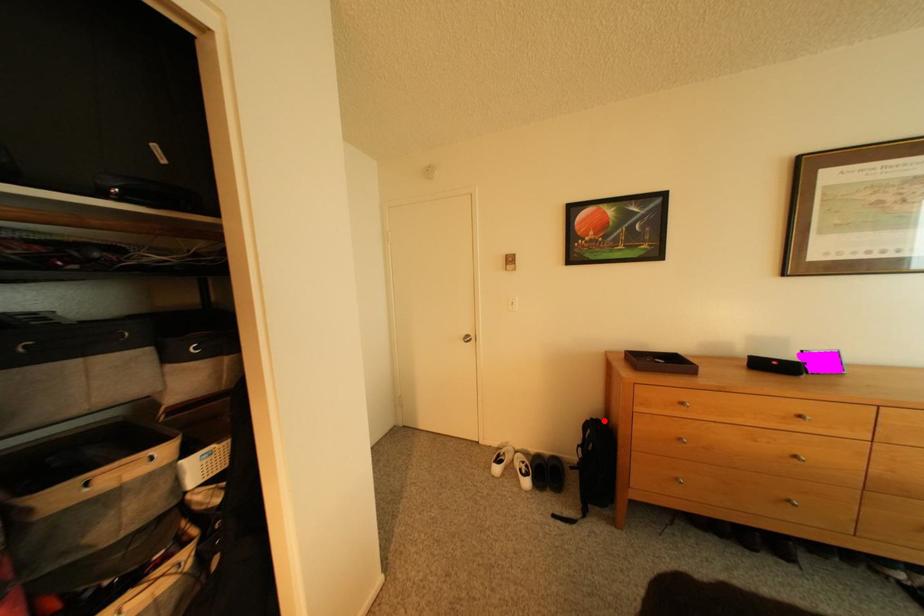
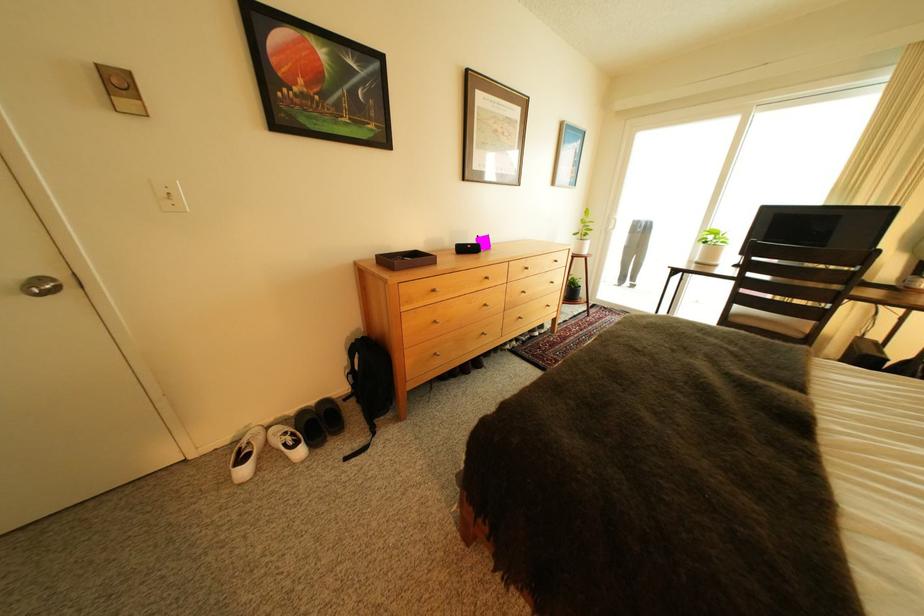
Question: A red point is marked in image1. In image2, is the corresponding 3D point closer to the camera or farther? Reply with the corresponding letter.

Choices:
 (A) The corresponding 3D point is closer.
 (B) The corresponding 3D point is farther.

Answer: (A)